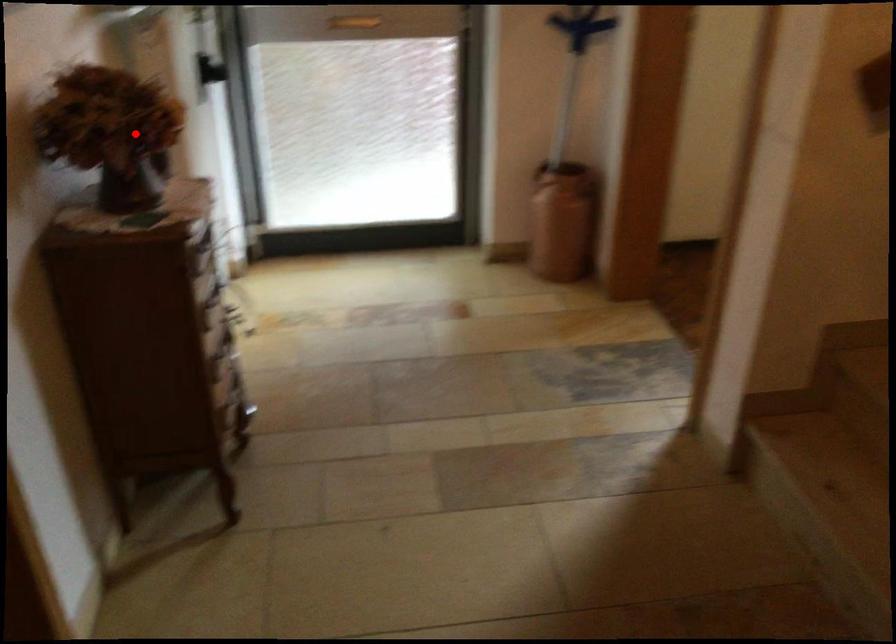
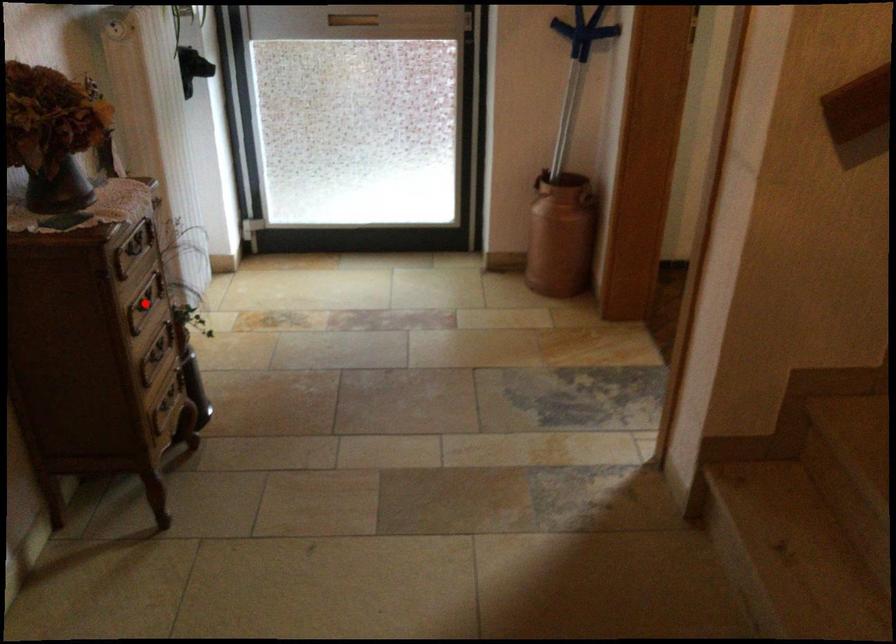
I am providing you with two images of the same scene from different viewpoints. A red point is marked on the first image and another point is marked on the second image. Is the marked point in image1 the same physical position as the marked point in image2?

No